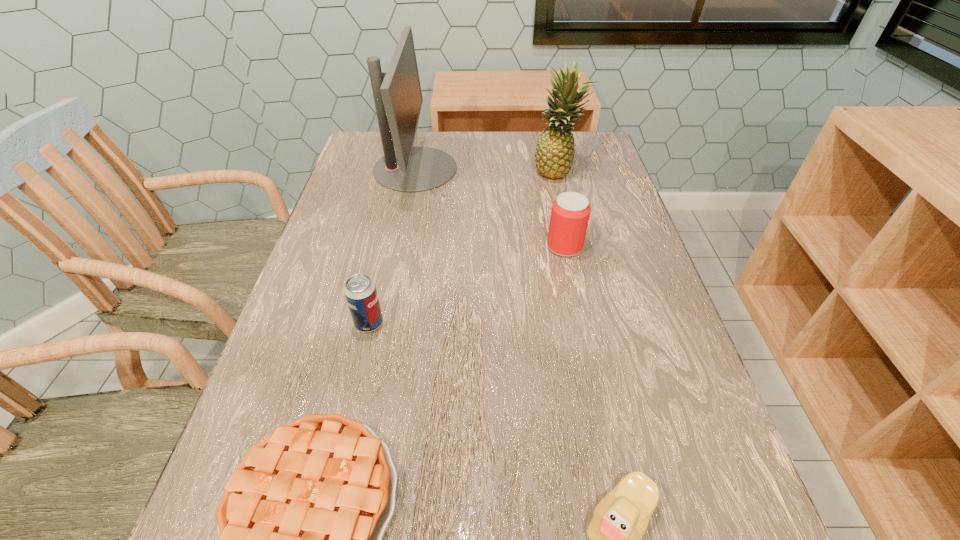
This screenshot has height=540, width=960. What are the coordinates of `computer monitor` in the screenshot? It's located at (398, 99).

Where is `pineapple`? The width and height of the screenshot is (960, 540). pineapple is located at coordinates (554, 154).

Locate an element on the screen. the right beer can is located at coordinates (570, 213).

Identify the location of the fourth nearest object. (570, 213).

Identify the location of the nearer beer can. The height and width of the screenshot is (540, 960). (360, 291).

Where is `the third nearest object`? This screenshot has width=960, height=540. the third nearest object is located at coordinates (360, 291).

Find the location of a particular element. This screenshot has height=540, width=960. vacant space positioned on the screen of the computer monitor is located at coordinates (584, 168).

This screenshot has width=960, height=540. Find the location of `free spot located 0.350m on the left of the pineapple`. free spot located 0.350m on the left of the pineapple is located at coordinates (411, 171).

Where is `free location located on the front of the farther beer can`? This screenshot has height=540, width=960. free location located on the front of the farther beer can is located at coordinates (577, 304).

Locate an element on the screen. This screenshot has height=540, width=960. vacant space situated 0.140m on the right of the nearer beer can is located at coordinates (453, 323).